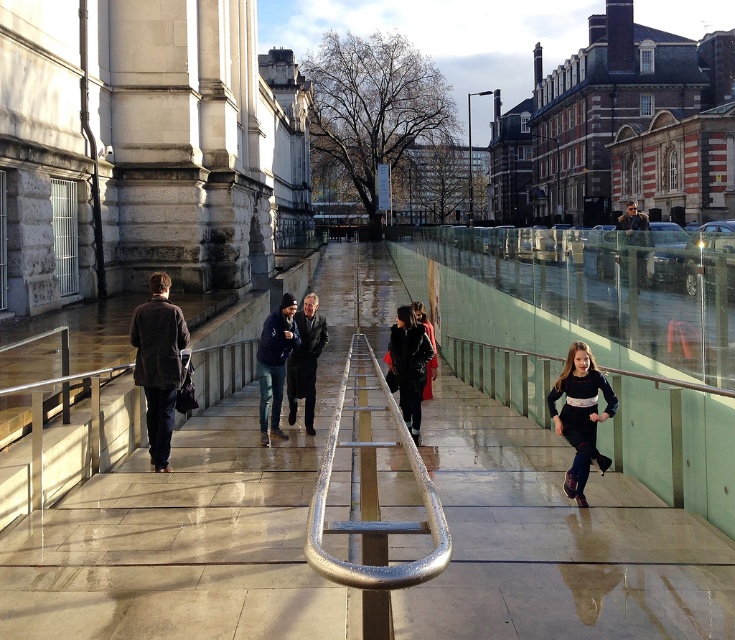
Question: Which point appears closest to the camera in this image?

Choices:
 (A) (318, 472)
 (B) (311, 403)

Answer: (A)

Question: Which point is closer to the camera?

Choices:
 (A) brown leather jacket at left
 (B) dark blue jersey at center
 (C) dark blue jacket at center
 (D) dark brown leather jacket at center

Answer: (B)

Question: Is shiny concrete pavement at center bigger than dark blue jacket at center?

Choices:
 (A) no
 (B) yes

Answer: (B)

Question: Considering the real-world distances, which object is farthest from the dark gray leather jacket at center?

Choices:
 (A) dark blue jersey at center
 (B) dark blue jacket at center
 (C) brown leather jacket at left
 (D) silver metallic rail at center

Answer: (C)

Question: Is shiny concrete pavement at center wider than black leather jacket at center?

Choices:
 (A) yes
 (B) no

Answer: (A)

Question: From the image, what is the correct spatial relationship of brown leather jacket at left in relation to black leather jacket at center?

Choices:
 (A) right
 (B) left

Answer: (B)